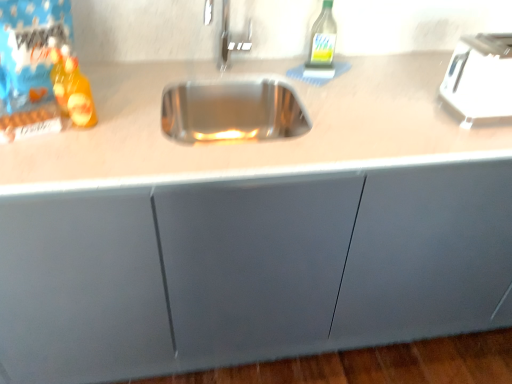
Question: Is green glass bottle at upper right, which ranks as the second bottle in front-to-back order, closer to the viewer compared to translucent plastic bottle at left, which is the second bottle in top-to-bottom order?

Choices:
 (A) yes
 (B) no

Answer: (B)

Question: Does green glass bottle at upper right, which ranks as the second bottle in front-to-back order, have a lesser width compared to translucent plastic bottle at left, marked as the first bottle in a bottom-to-top arrangement?

Choices:
 (A) no
 (B) yes

Answer: (A)

Question: Is green glass bottle at upper right, which is the first bottle in back-to-front order, shorter than translucent plastic bottle at left, which is the second bottle in top-to-bottom order?

Choices:
 (A) yes
 (B) no

Answer: (B)

Question: From the image's perspective, is green glass bottle at upper right, which ranks as the second bottle in left-to-right order, below translucent plastic bottle at left, which is the second bottle in top-to-bottom order?

Choices:
 (A) yes
 (B) no

Answer: (B)

Question: Is green glass bottle at upper right, which is the first bottle in back-to-front order, at the right side of translucent plastic bottle at left, marked as the first bottle in a front-to-back arrangement?

Choices:
 (A) yes
 (B) no

Answer: (A)

Question: In terms of width, does white plastic toaster at upper right look wider or thinner when compared to translucent plastic bottle at left, marked as the first bottle in a front-to-back arrangement?

Choices:
 (A) thin
 (B) wide

Answer: (B)

Question: Is point (502, 46) positioned closer to the camera than point (56, 97)?

Choices:
 (A) farther
 (B) closer

Answer: (A)

Question: Looking at the image, does white plastic toaster at upper right seem bigger or smaller compared to translucent plastic bottle at left, which is the second bottle in top-to-bottom order?

Choices:
 (A) big
 (B) small

Answer: (A)

Question: From a real-world perspective, is white plastic toaster at upper right above or below translucent plastic bottle at left, the 2th bottle from the right?

Choices:
 (A) below
 (B) above

Answer: (A)

Question: Is translucent plastic bottle at left, which is the second bottle in top-to-bottom order, in front of or behind green glass bottle at upper right, which ranks as the second bottle in front-to-back order, in the image?

Choices:
 (A) behind
 (B) front

Answer: (B)

Question: Looking at the image, does translucent plastic bottle at left, marked as the first bottle in a front-to-back arrangement, seem bigger or smaller compared to green glass bottle at upper right, which ranks as the second bottle in left-to-right order?

Choices:
 (A) big
 (B) small

Answer: (B)

Question: Do you think translucent plastic bottle at left, marked as the first bottle in a front-to-back arrangement, is within green glass bottle at upper right, which appears as the second bottle when ordered from the bottom, or outside of it?

Choices:
 (A) outside
 (B) inside

Answer: (A)

Question: From the image's perspective, is translucent plastic bottle at left, which is the 1th bottle from left to right, positioned above or below green glass bottle at upper right, which ranks as the second bottle in left-to-right order?

Choices:
 (A) above
 (B) below

Answer: (B)

Question: In the image, is white plastic toaster at upper right positioned in front of or behind green glass bottle at upper right, which ranks as the second bottle in left-to-right order?

Choices:
 (A) front
 (B) behind

Answer: (A)

Question: Is white plastic toaster at upper right to the left or to the right of green glass bottle at upper right, which ranks as the second bottle in front-to-back order, in the image?

Choices:
 (A) right
 (B) left

Answer: (A)